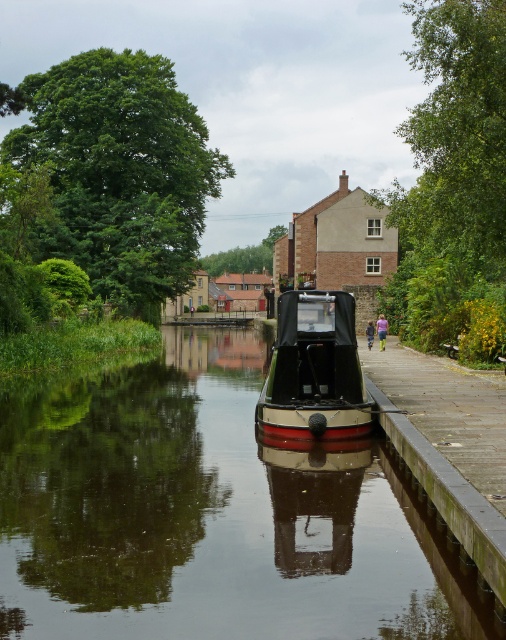
Is smooth black water at center to the left of polished wood boat at center from the viewer's perspective?

Correct, you'll find smooth black water at center to the left of polished wood boat at center.

Which is behind, point (343, 465) or point (308, 384)?

The point (308, 384) is behind.

Find the location of a particular element. The image size is (506, 640). smooth black water at center is located at coordinates (210, 515).